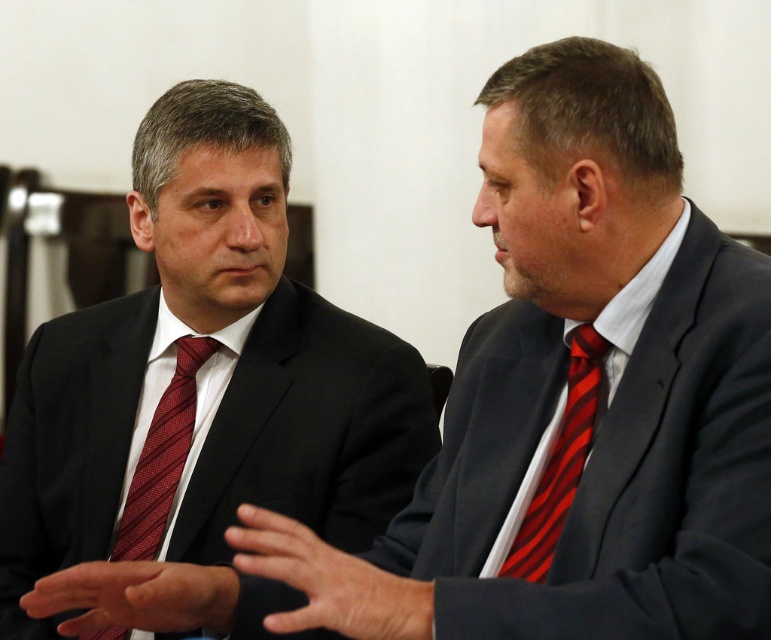
From the picture: Who is more forward, (679, 452) or (541, 529)?

Point (679, 452) is in front.

This screenshot has width=771, height=640. Identify the location of matte black suit at left. (571, 403).

Is point (513, 394) less distant than point (551, 528)?

No, it is not.

The image size is (771, 640). I want to click on matte black suit at left, so click(x=571, y=403).

Is matte black suit at center in front of red striped tie at right?

Yes.

Does matte black suit at center appear under red striped tie at right?

Actually, matte black suit at center is above red striped tie at right.

This screenshot has height=640, width=771. What are the coordinates of `matte black suit at center` in the screenshot? It's located at (204, 378).

I want to click on matte black suit at center, so click(x=204, y=378).

Can you confirm if red striped tie at left is shorter than red striped tie at right?

In fact, red striped tie at left may be taller than red striped tie at right.

Is red striped tie at left further to the viewer compared to red striped tie at right?

Yes, red striped tie at left is further from the viewer.

What do you see at coordinates (160, 456) in the screenshot? The height and width of the screenshot is (640, 771). I see `red striped tie at left` at bounding box center [160, 456].

Where is `red striped tie at left`? This screenshot has width=771, height=640. red striped tie at left is located at coordinates (160, 456).